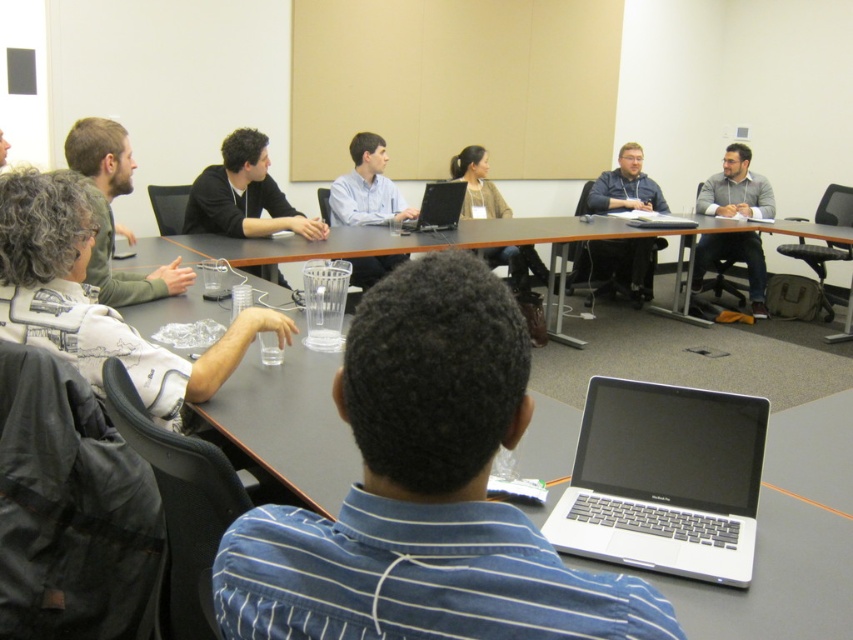
Question: Estimate the real-world distances between objects in this image. Which object is farther from the smooth wooden table at center?

Choices:
 (A) black leather jacket at lower left
 (B) gray fabric shirt at upper right
 (C) light brown leather jacket at left
 (D) light blue shirt at center

Answer: (A)

Question: Which point is closer to the camera?

Choices:
 (A) silver/black laptop at center
 (B) dark brown hair at upper left
 (C) gray fabric shirt at upper right
 (D) smooth wooden table at center

Answer: (A)

Question: Is dark brown hair at upper left bigger than matte gray hoodie at upper right?

Choices:
 (A) yes
 (B) no

Answer: (A)

Question: Is the position of blue striped shirt at center more distant than that of black matte laptop at center?

Choices:
 (A) no
 (B) yes

Answer: (A)

Question: Which object is farther from the camera taking this photo?

Choices:
 (A) smooth wooden table at center
 (B) black matte laptop at center
 (C) blue striped shirt at center
 (D) silver/black laptop at center

Answer: (B)

Question: Can you confirm if blue striped shirt at center is smaller than smooth wooden table at center?

Choices:
 (A) yes
 (B) no

Answer: (A)